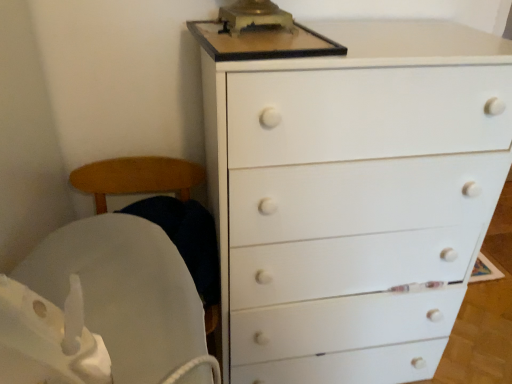
Locate an element on the screen. The height and width of the screenshot is (384, 512). free point above white matte chest of drawers at upper right (from a real-world perspective) is located at coordinates (348, 29).